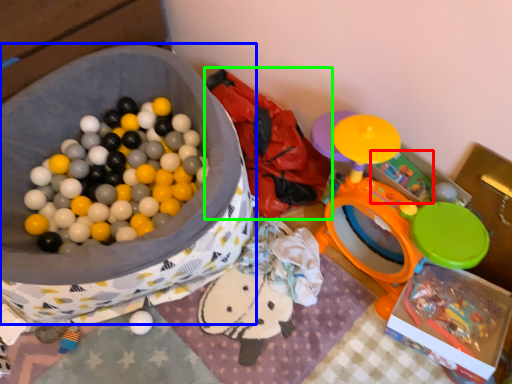
Question: Which object is the closest to the toy (highlighted by a red box)? Choose among these: storage box (highlighted by a blue box) or bean bag chair (highlighted by a green box).

Choices:
 (A) storage box
 (B) bean bag chair

Answer: (B)